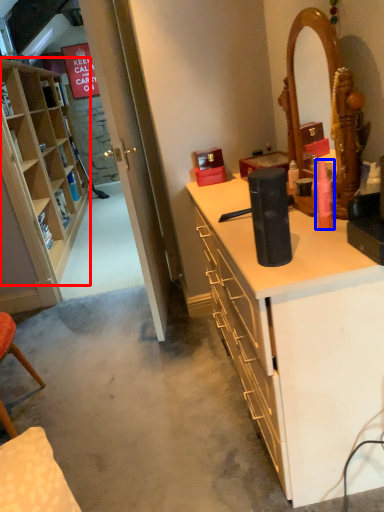
Question: Which point is closer to the camera, cabinetry (highlighted by a red box) or toiletry (highlighted by a blue box)?

Choices:
 (A) cabinetry
 (B) toiletry

Answer: (B)